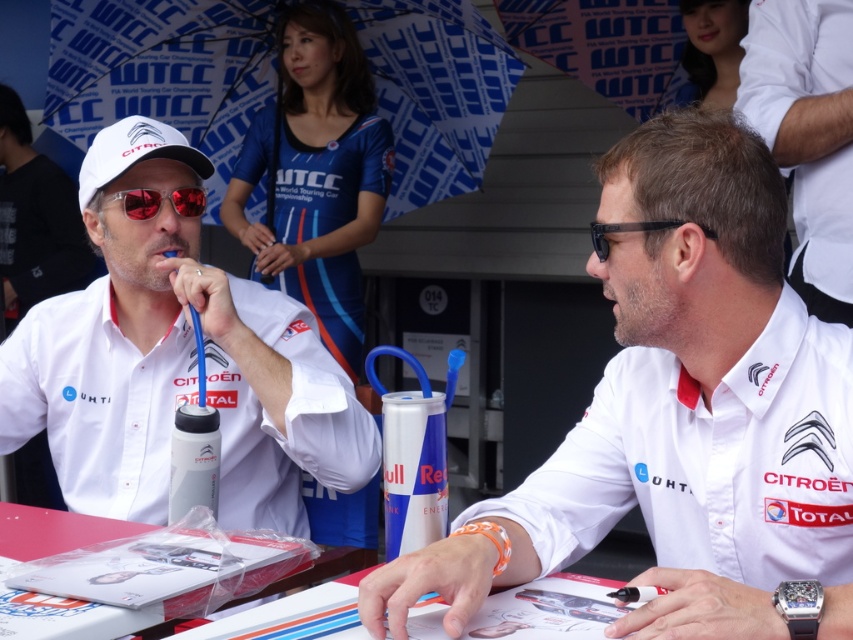
Question: Which point is farther to the camera?

Choices:
 (A) white matte shirt at left
 (B) white fabric shirt at center
 (C) white matte shirt at center
 (D) blue fabric umbrella at upper center

Answer: (D)

Question: From the image, what is the correct spatial relationship of clear plastic bag at center in relation to red reflective lenses at center?

Choices:
 (A) below
 (B) above

Answer: (A)

Question: Can you confirm if white fabric shirt at center is positioned to the right of clear plastic bag at center?

Choices:
 (A) yes
 (B) no

Answer: (A)

Question: Is blue fabric umbrella at upper center further to the viewer compared to white fabric shirt at center?

Choices:
 (A) no
 (B) yes

Answer: (B)

Question: Which point is farther to the camera?

Choices:
 (A) (132, 198)
 (B) (827, 164)
 (C) (57, 449)
 (D) (91, 164)

Answer: (B)

Question: Which of the following is the closest to the observer?

Choices:
 (A) (614, 221)
 (B) (836, 156)

Answer: (A)